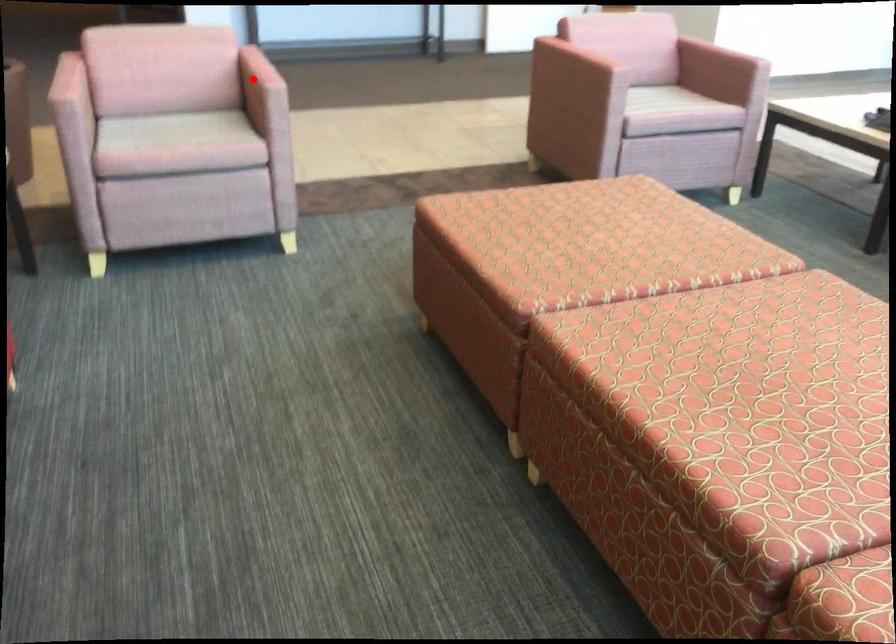
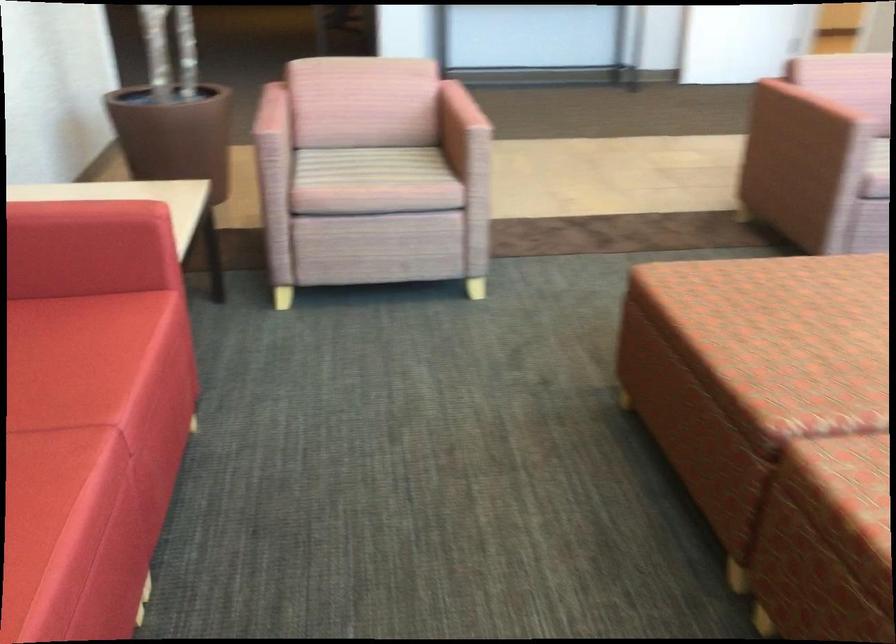
Find the pixel in the second image that matches the highlighted location in the first image.

(459, 118)